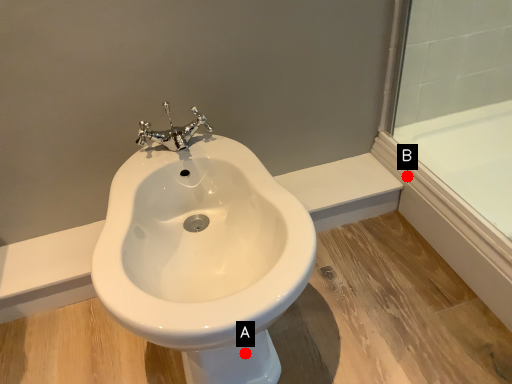
Question: Two points are circled on the image, labeled by A and B beside each circle. Which point is further to the camera?

Choices:
 (A) A is further
 (B) B is further

Answer: (B)